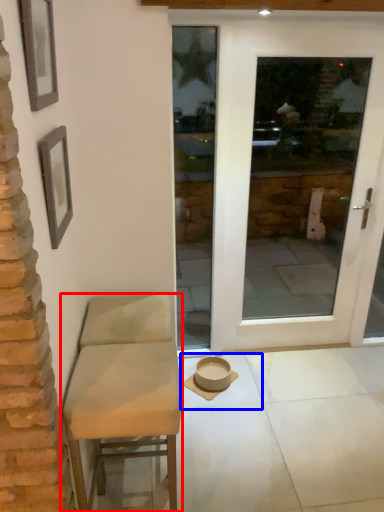
Question: Which point is further to the camera, chair (highlighted by a red box) or tile (highlighted by a blue box)?

Choices:
 (A) chair
 (B) tile

Answer: (B)